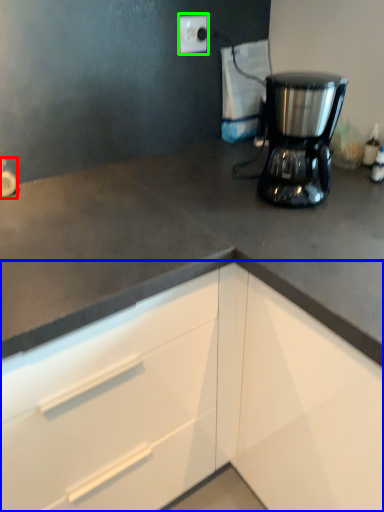
Question: Considering the real-world distances, which object is closest to faucet (highlighted by a red box)? cabinetry (highlighted by a blue box) or electric outlet (highlighted by a green box).

Choices:
 (A) cabinetry
 (B) electric outlet

Answer: (B)